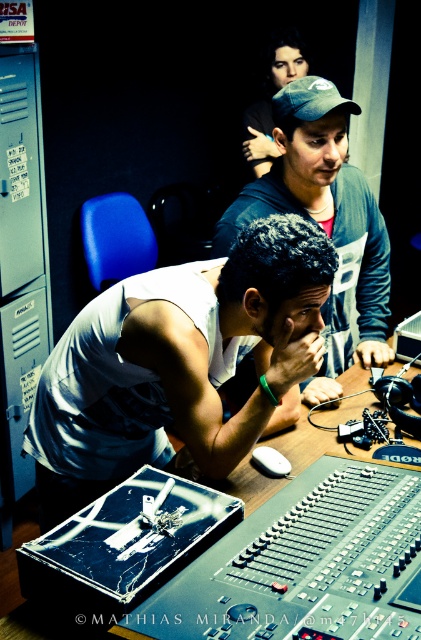
Between point (103, 388) and point (373, 300), which one is positioned behind?

The point (373, 300) is behind.

The width and height of the screenshot is (421, 640). Identify the location of white matte tank top at center. (178, 362).

Locate an element on the screen. The image size is (421, 640). white matte tank top at center is located at coordinates (178, 362).